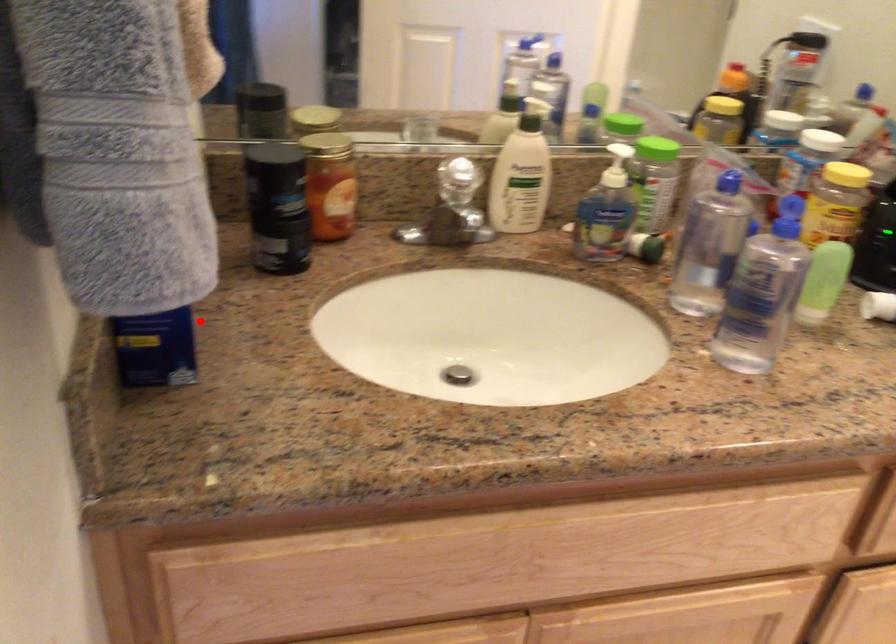
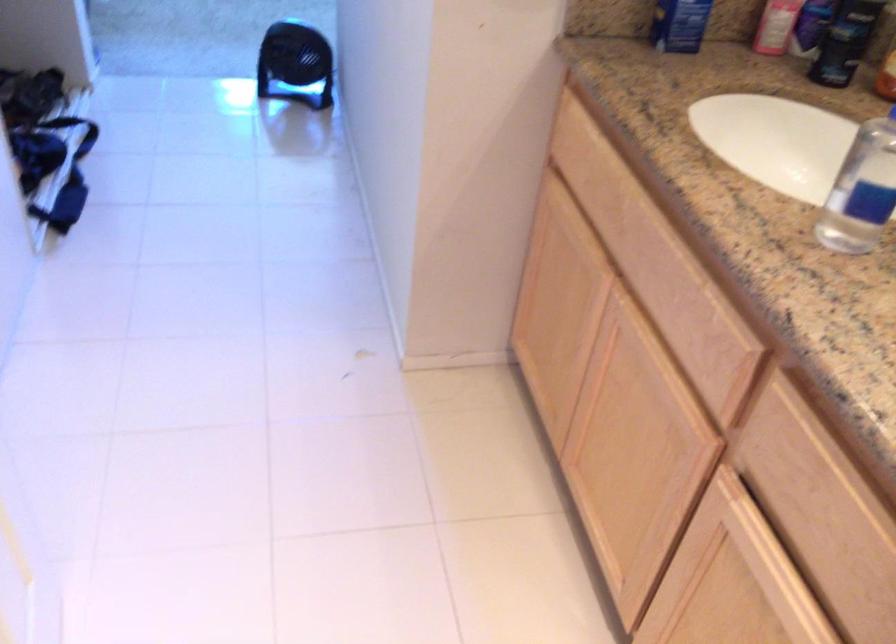
Where in the second image is the point corresponding to the highlighted location from the first image?

(679, 24)